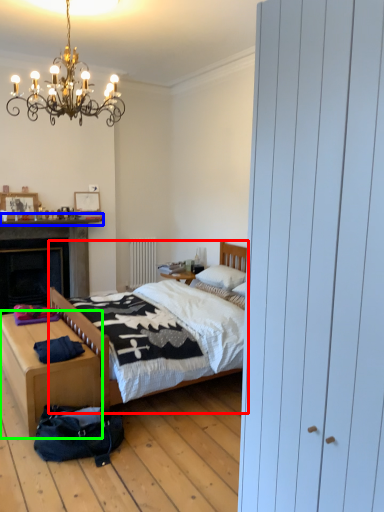
Question: Estimate the real-world distances between objects in this image. Which object is farther from bed (highlighted by a red box), mantle (highlighted by a blue box) or nightstand (highlighted by a green box)?

Choices:
 (A) mantle
 (B) nightstand

Answer: (A)